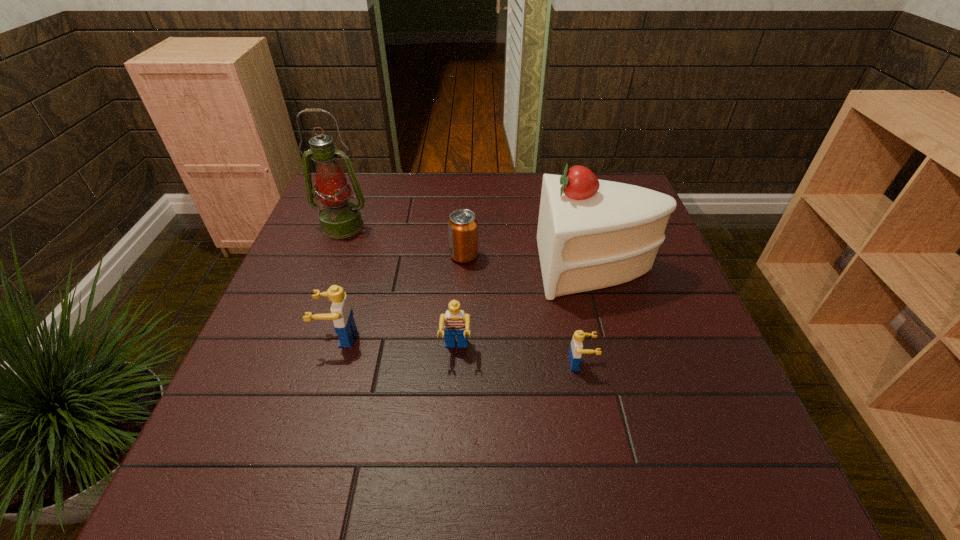
Please point a free position for a Lego on the right. Please provide its 2D coordinates. Your answer should be formatted as a tuple, i.e. [(x, y)], where the tuple contains the x and y coordinates of a point satisfying the conditions above.

[(712, 378)]